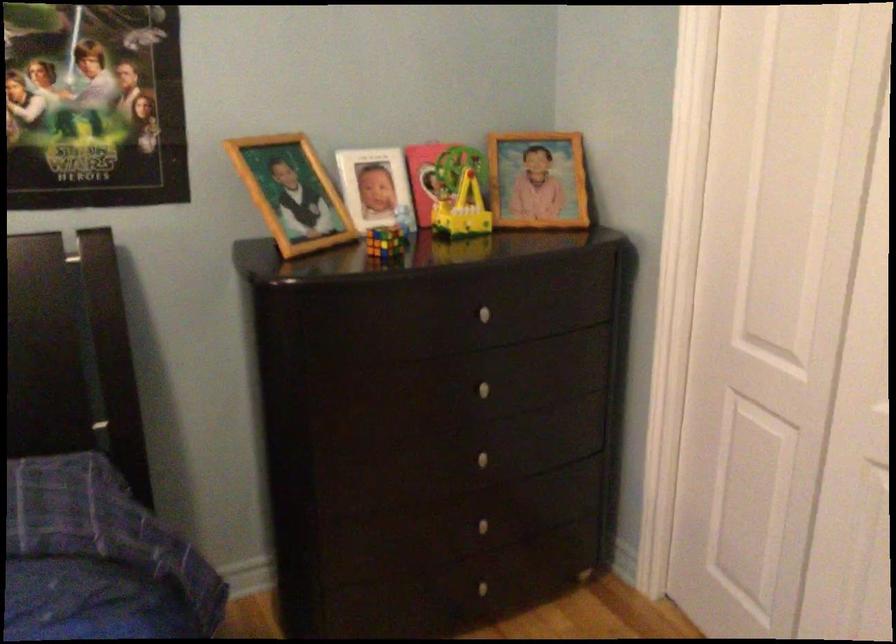
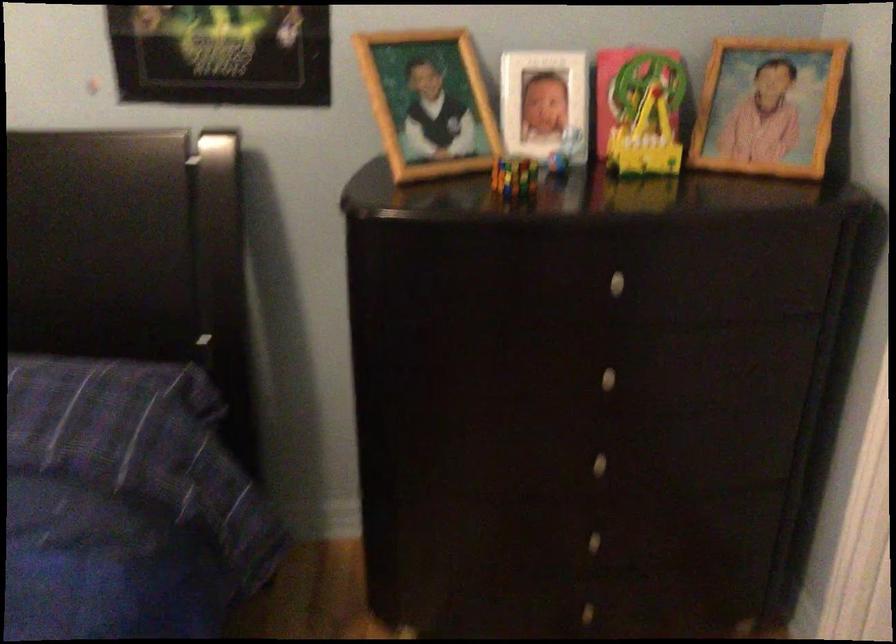
Question: The camera is either moving clockwise (left) or counter-clockwise (right) around the object. The first image is from the beginning of the video and the second image is from the end. Is the camera moving left or right when shooting the video?

Choices:
 (A) Left
 (B) Right

Answer: (B)